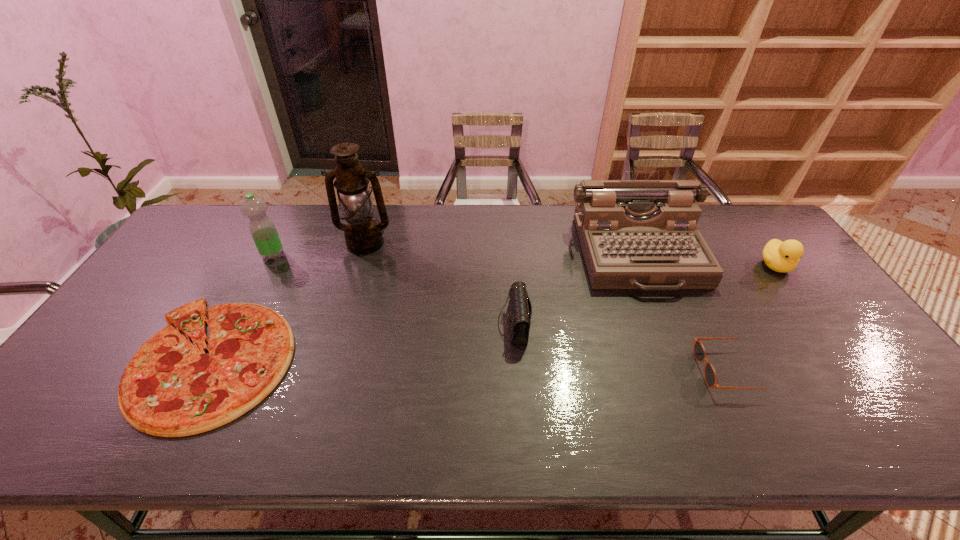
Where is `free point located 0.050m on the right of the pizza`? Image resolution: width=960 pixels, height=540 pixels. free point located 0.050m on the right of the pizza is located at coordinates (312, 360).

Where is `oil lamp situated at the far edge`? This screenshot has height=540, width=960. oil lamp situated at the far edge is located at coordinates (363, 235).

Image resolution: width=960 pixels, height=540 pixels. In order to click on typewriter that is at the far edge in this screenshot , I will do `click(635, 234)`.

The width and height of the screenshot is (960, 540). I want to click on object that is positioned at the near edge, so click(170, 388).

This screenshot has width=960, height=540. Identify the location of object situated at the left edge. (170, 388).

Identify the location of object at the right edge. The width and height of the screenshot is (960, 540). click(x=782, y=257).

Identify the location of object that is at the near left corner. The width and height of the screenshot is (960, 540). (x=170, y=388).

In the image, there is a desktop. Identify the location of free region at the far edge. The width and height of the screenshot is (960, 540). (292, 234).

In the image, there is a desktop. Identify the location of vacant space at the near edge. (686, 450).

In the image, there is a desktop. Where is `free region at the left edge`? Image resolution: width=960 pixels, height=540 pixels. free region at the left edge is located at coordinates (108, 340).